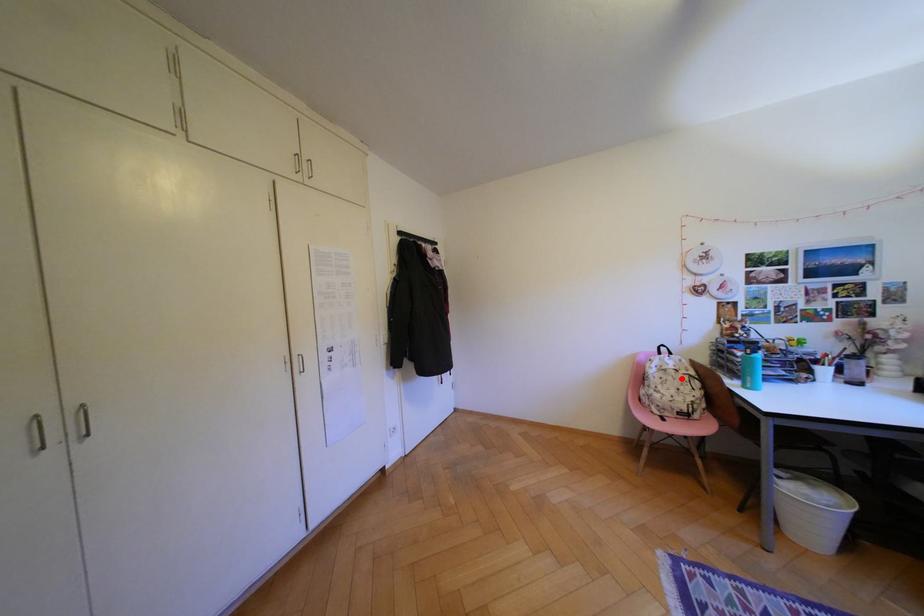
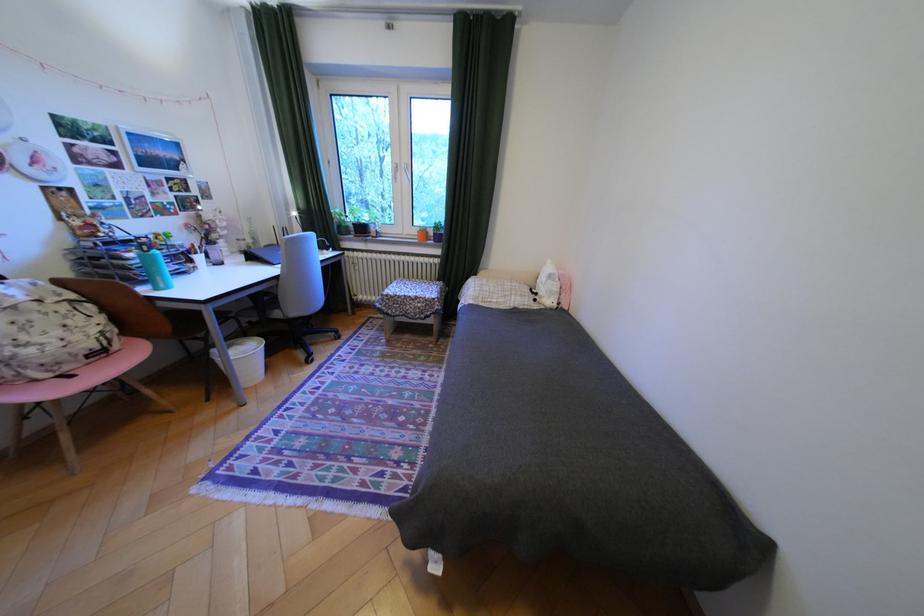
Find the pixel in the second image that matches the highlighted location in the first image.

(49, 317)